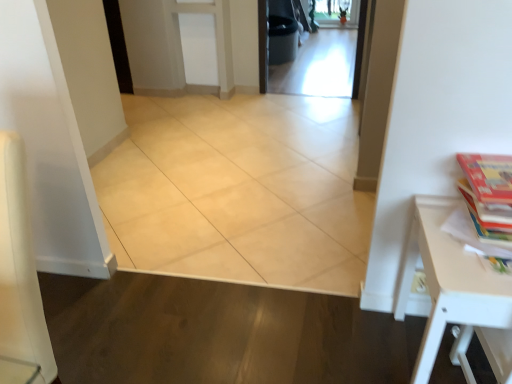
Question: Considering the relative sizes of multicolored paper book at right and transparent glass screen door at center in the image provided, is multicolored paper book at right bigger than transparent glass screen door at center?

Choices:
 (A) no
 (B) yes

Answer: (A)

Question: Does multicolored paper book at right lie behind transparent glass screen door at center?

Choices:
 (A) yes
 (B) no

Answer: (B)

Question: From the image's perspective, is multicolored paper book at right beneath transparent glass screen door at center?

Choices:
 (A) no
 (B) yes

Answer: (B)

Question: Considering the relative sizes of multicolored paper book at right and transparent glass screen door at center in the image provided, is multicolored paper book at right shorter than transparent glass screen door at center?

Choices:
 (A) yes
 (B) no

Answer: (B)

Question: Considering the relative sizes of multicolored paper book at right and transparent glass screen door at center in the image provided, is multicolored paper book at right taller than transparent glass screen door at center?

Choices:
 (A) no
 (B) yes

Answer: (B)

Question: In terms of height, does white matte table at right look taller or shorter compared to transparent glass screen door at center?

Choices:
 (A) short
 (B) tall

Answer: (B)

Question: Does point (418, 205) appear closer or farther from the camera than point (329, 56)?

Choices:
 (A) closer
 (B) farther

Answer: (A)

Question: From the image's perspective, is white matte table at right positioned above or below transparent glass screen door at center?

Choices:
 (A) below
 (B) above

Answer: (A)

Question: Would you say white matte table at right is to the left or to the right of transparent glass screen door at center in the picture?

Choices:
 (A) left
 (B) right

Answer: (A)

Question: Is transparent glass screen door at center wider or thinner than beige ceramic tile at center?

Choices:
 (A) thin
 (B) wide

Answer: (B)

Question: In the image, is transparent glass screen door at center positioned in front of or behind beige ceramic tile at center?

Choices:
 (A) behind
 (B) front

Answer: (A)

Question: Is point (350, 59) closer or farther from the camera than point (261, 178)?

Choices:
 (A) farther
 (B) closer

Answer: (A)

Question: From the image's perspective, relative to beige ceramic tile at center, is transparent glass screen door at center above or below?

Choices:
 (A) below
 (B) above

Answer: (B)

Question: Based on their positions, is white matte table at right located to the left or right of multicolored paper book at right?

Choices:
 (A) left
 (B) right

Answer: (A)

Question: In terms of width, does white matte table at right look wider or thinner when compared to multicolored paper book at right?

Choices:
 (A) thin
 (B) wide

Answer: (B)